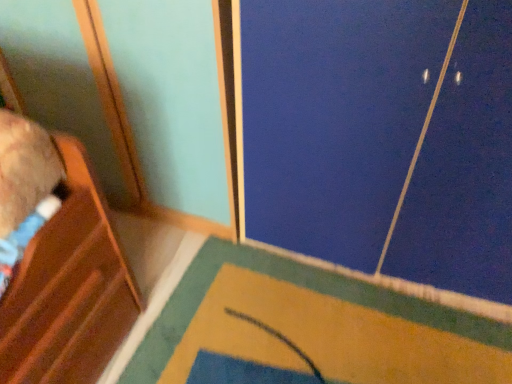
You are a GUI agent. You are given a task and a screenshot of the screen. Output one action in this format:
    pyautogui.click(x=<x>, y=<y>)
    Task: Click on the empty space that is ontop of yellow fabric doormat at lower center (from a real-world perspective)
    
    Given the screenshot: What is the action you would take?
    pyautogui.click(x=257, y=304)